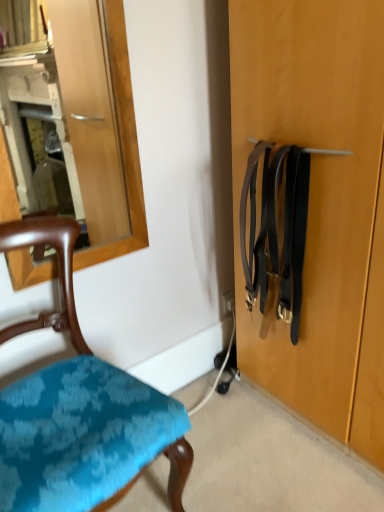
Question: Is teal fabric chair at lower left positioned far away from black leather suspenders at right?

Choices:
 (A) no
 (B) yes

Answer: (A)

Question: Does teal fabric chair at lower left have a larger size compared to black leather suspenders at right?

Choices:
 (A) yes
 (B) no

Answer: (A)

Question: From a real-world perspective, is teal fabric chair at lower left on top of black leather suspenders at right?

Choices:
 (A) no
 (B) yes

Answer: (A)

Question: Is teal fabric chair at lower left to the right of black leather suspenders at right from the viewer's perspective?

Choices:
 (A) yes
 (B) no

Answer: (B)

Question: Does teal fabric chair at lower left have a greater width compared to black leather suspenders at right?

Choices:
 (A) no
 (B) yes

Answer: (B)

Question: Is black leather suspenders at right inside teal fabric chair at lower left?

Choices:
 (A) no
 (B) yes

Answer: (A)

Question: From the image's perspective, is black leather suspenders at right beneath teal fabric chair at lower left?

Choices:
 (A) no
 (B) yes

Answer: (A)

Question: From the image's perspective, does black leather suspenders at right appear higher than teal fabric chair at lower left?

Choices:
 (A) yes
 (B) no

Answer: (A)

Question: Is black leather suspenders at right surrounding teal fabric chair at lower left?

Choices:
 (A) no
 (B) yes

Answer: (A)

Question: Is black leather suspenders at right oriented towards teal fabric chair at lower left?

Choices:
 (A) no
 (B) yes

Answer: (B)

Question: Is black leather suspenders at right bigger than teal fabric chair at lower left?

Choices:
 (A) no
 (B) yes

Answer: (A)

Question: Is the depth of black leather suspenders at right greater than that of teal fabric chair at lower left?

Choices:
 (A) no
 (B) yes

Answer: (B)

Question: Considering the positions of black leather suspenders at right and teal fabric chair at lower left in the image, is black leather suspenders at right wider or thinner than teal fabric chair at lower left?

Choices:
 (A) wide
 (B) thin

Answer: (B)